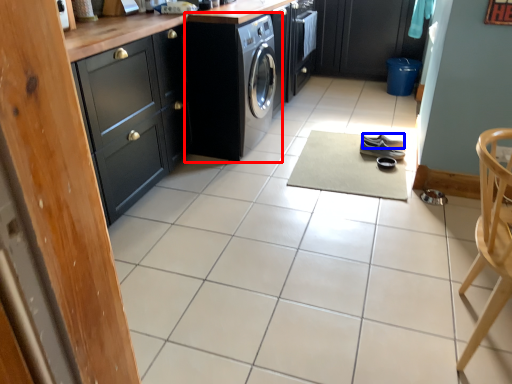
Question: Which object appears closest to the camera in this image, washing machine (highlighted by a red box) or footwear (highlighted by a blue box)?

Choices:
 (A) washing machine
 (B) footwear

Answer: (A)